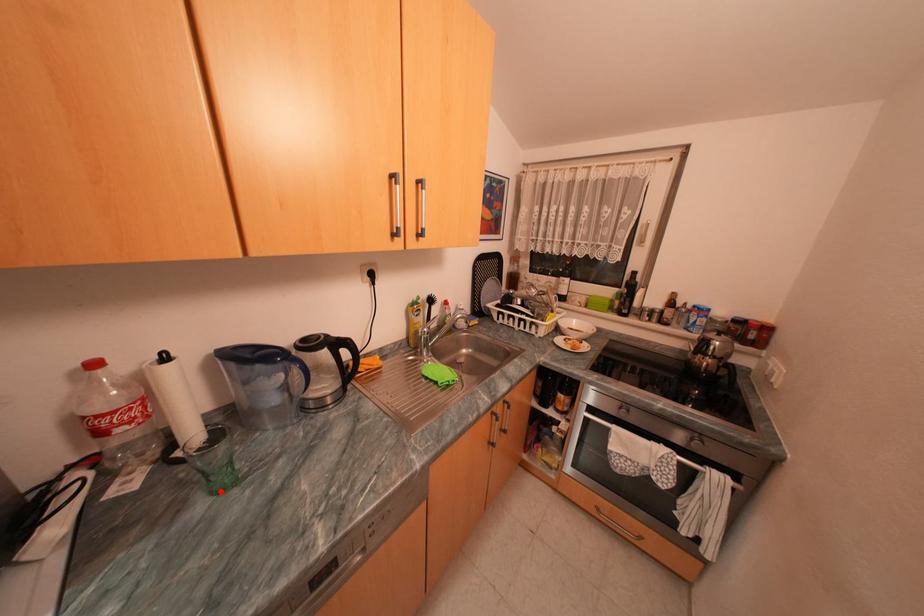
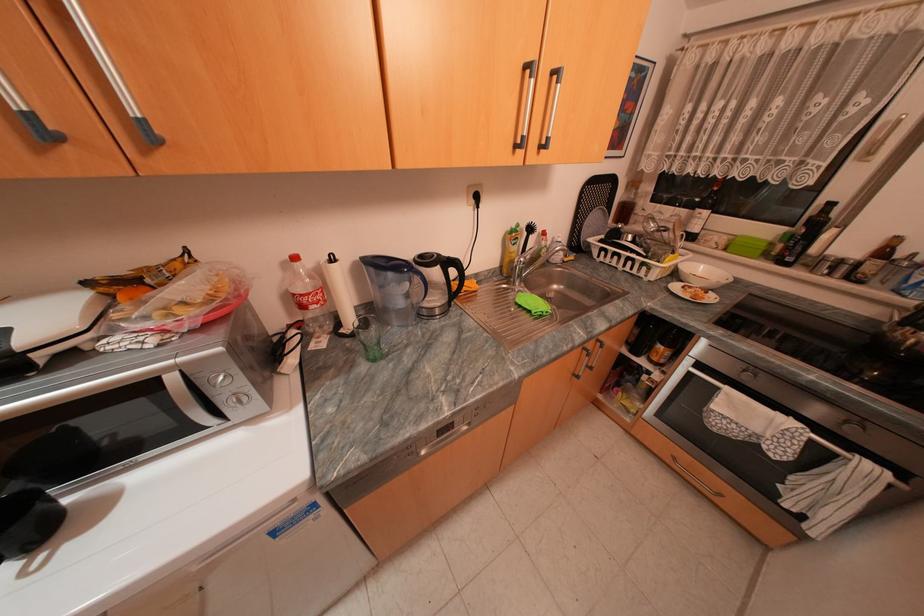
In the second image, find the point that corresponds to the highlighted location in the first image.

(378, 359)